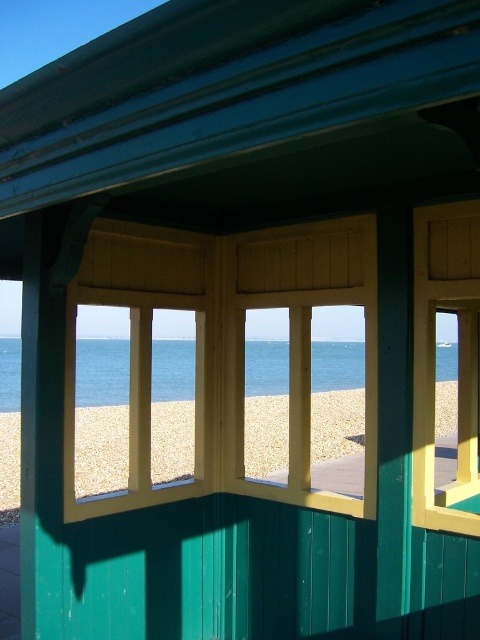
Does point (191, 432) come closer to viewer compared to point (333, 358)?

Yes, it is.

How distant is smooth sand at lower center from blue water at center?

6.97 feet

The image size is (480, 640). I want to click on smooth sand at lower center, so click(x=100, y=449).

You are a GUI agent. You are given a task and a screenshot of the screen. Output one action in this format:
    pyautogui.click(x=<x>, y=<y>)
    Task: Click on the smooth sand at lower center
    
    Given the screenshot: What is the action you would take?
    pyautogui.click(x=100, y=449)